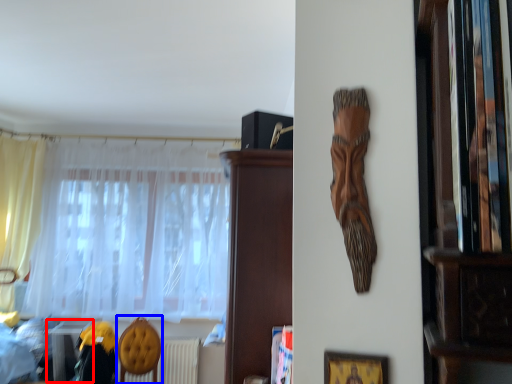
Question: Which of the following is the farthest to the observer, table (highlighted by a red box) or armchair (highlighted by a blue box)?

Choices:
 (A) table
 (B) armchair

Answer: (A)